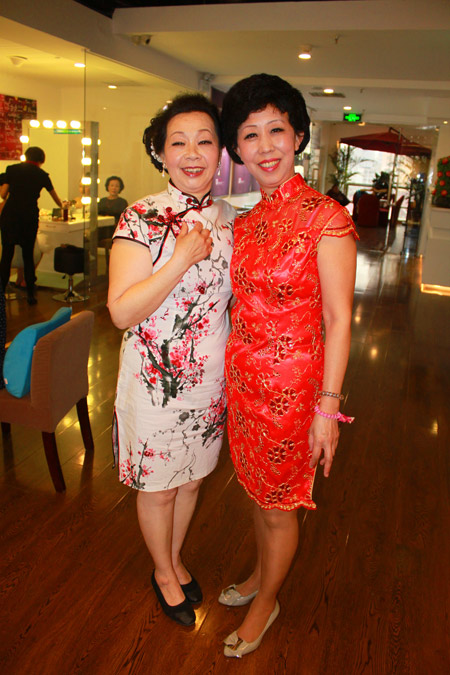
Identify the location of beige ceiling. The width and height of the screenshot is (450, 675). (230, 54).